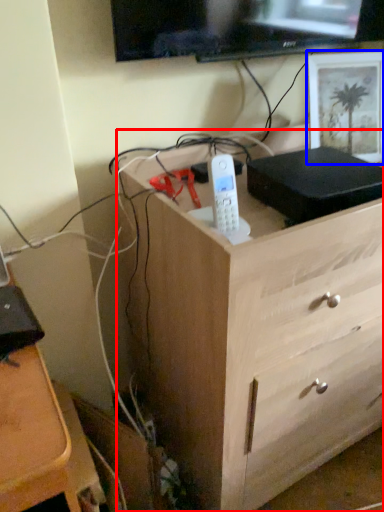
Question: Which of the following is the farthest to the observer, chest of drawers (highlighted by a red box) or picture frame (highlighted by a blue box)?

Choices:
 (A) chest of drawers
 (B) picture frame

Answer: (B)